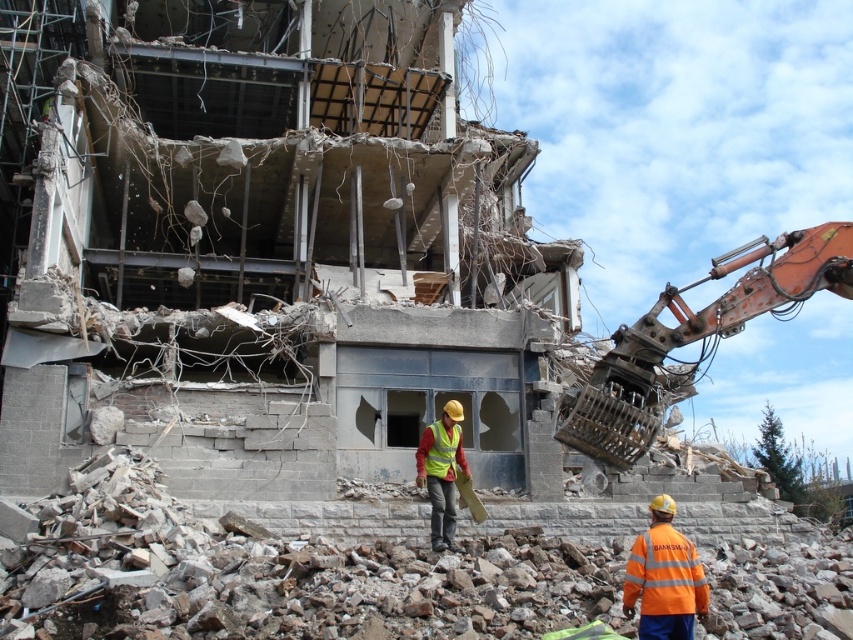
You are a safety inspector at the demolition site. You need to ensure that the high visibility fabric safety vest at center is visible to the operator of the rusty metal excavator at right. Based on their positions, is the safety vest likely to be in the operator s line of sight?

The rusty metal excavator at right is in front of the high visibility fabric safety vest at center, meaning the vest is behind the excavator from the operator s viewpoint. This would block the operator s line of sight, making the vest less visible.